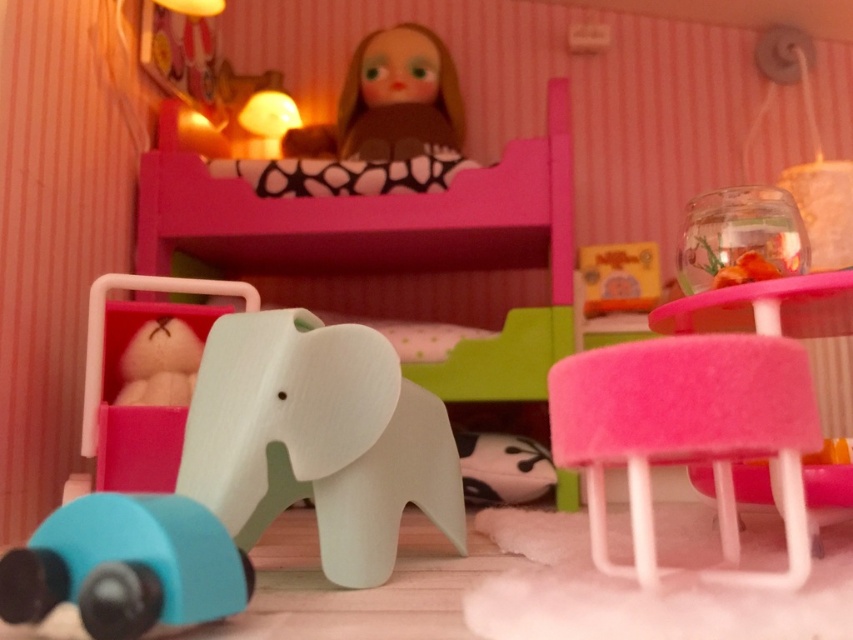
Who is higher up, pink matte bunk bed at upper center or fuzzy pink stool at lower right?

pink matte bunk bed at upper center

Does pink matte bunk bed at upper center lie behind fuzzy pink stool at lower right?

Yes, it is.

Is point (280, 273) positioned in front of point (605, 387)?

No.

At what (x,y) coordinates should I click in order to perform the action: click on pink matte bunk bed at upper center. Please return your answer as a coordinate pair (x, y). Looking at the image, I should click on tap(389, 243).

Consider the image. Can you confirm if light green matte elephant at center is thinner than pink matte bunk bed at upper center?

Yes, light green matte elephant at center is thinner than pink matte bunk bed at upper center.

Between light green matte elephant at center and pink matte bunk bed at upper center, which one is positioned higher?

pink matte bunk bed at upper center

Image resolution: width=853 pixels, height=640 pixels. Identify the location of light green matte elephant at center. (252, 483).

You are a GUI agent. You are given a task and a screenshot of the screen. Output one action in this format:
    pyautogui.click(x=<x>, y=<y>)
    Task: Click on the light green matte elephant at center
    
    Given the screenshot: What is the action you would take?
    pyautogui.click(x=252, y=483)

Which of these two, fuzzy pink stool at lower right or blue rubber toy car at lower left, stands shorter?

With less height is blue rubber toy car at lower left.

Between point (689, 339) and point (198, 541), which one is positioned in front?

Point (198, 541)

Measure the distance between point (798, 573) and camera.

The distance of point (798, 573) from camera is 31.54 inches.

Where is `fuzzy pink stool at lower right`? fuzzy pink stool at lower right is located at coordinates (686, 435).